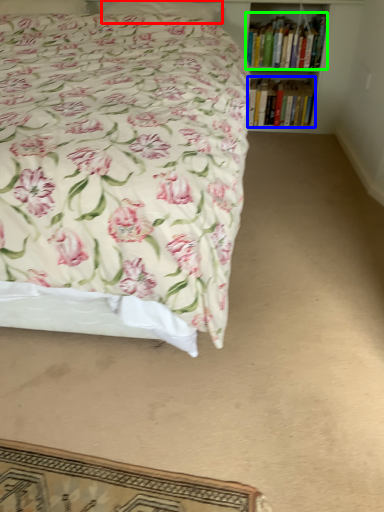
Question: Which is nearer to the pillow (highlighted by a red box)? book (highlighted by a blue box) or book (highlighted by a green box).

Choices:
 (A) book
 (B) book

Answer: (B)